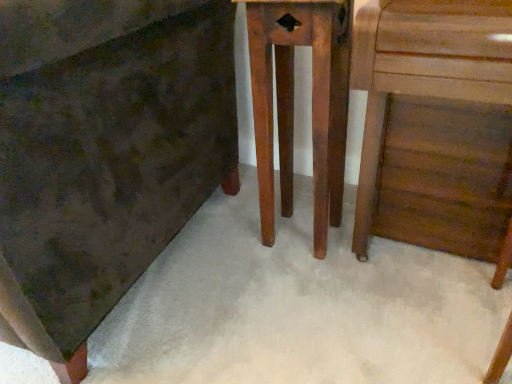
The height and width of the screenshot is (384, 512). What are the coordinates of `free space in front of wooden table at center` in the screenshot? It's located at (311, 284).